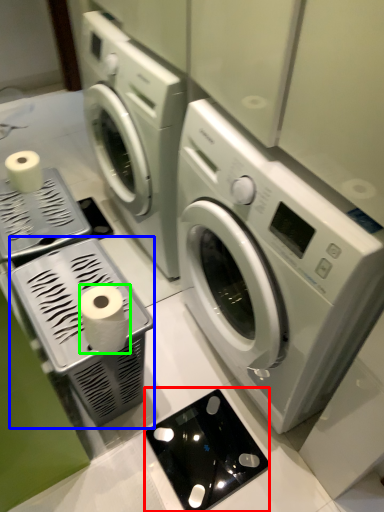
Question: Which object is positioned closest to appliance (highlighted by a red box)? Select from appliance (highlighted by a blue box) and toilet paper (highlighted by a green box).

Choices:
 (A) appliance
 (B) toilet paper

Answer: (A)